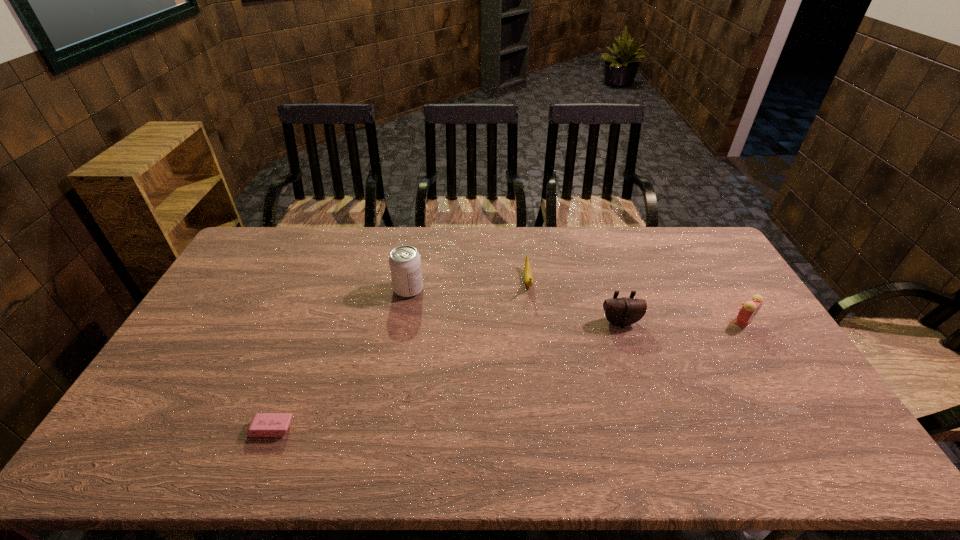
Find the location of a particular element. vacant point at the far left corner is located at coordinates (246, 252).

Locate an element on the screen. Image resolution: width=960 pixels, height=540 pixels. blank space at the far right corner is located at coordinates (699, 234).

You are a GUI agent. You are given a task and a screenshot of the screen. Output one action in this format:
    pyautogui.click(x=<x>, y=<y>)
    Task: Click on the free space between the fourth object from right to left and the leftmost object
    Image resolution: width=960 pixels, height=540 pixels.
    Given the screenshot: What is the action you would take?
    pyautogui.click(x=340, y=359)

Where is `free space between the shortest object and the second shortest object`? This screenshot has width=960, height=540. free space between the shortest object and the second shortest object is located at coordinates (399, 355).

Identify the location of empty space between the second shortest object and the soda can. (468, 285).

Locate an element on the screen. empty location between the tallest object and the alarm clock is located at coordinates (576, 306).

Find the location of a particular element. The image size is (960, 540). vacant area that lies between the fourth object from right to left and the third object from left to right is located at coordinates (468, 285).

Where is `unoccupied area between the pouch and the eraser`? The width and height of the screenshot is (960, 540). unoccupied area between the pouch and the eraser is located at coordinates (446, 375).

Where is `free space between the shortest object and the third object from left to right`? Image resolution: width=960 pixels, height=540 pixels. free space between the shortest object and the third object from left to right is located at coordinates (399, 355).

This screenshot has width=960, height=540. Identify the location of free area in between the tallest object and the pouch. (515, 306).